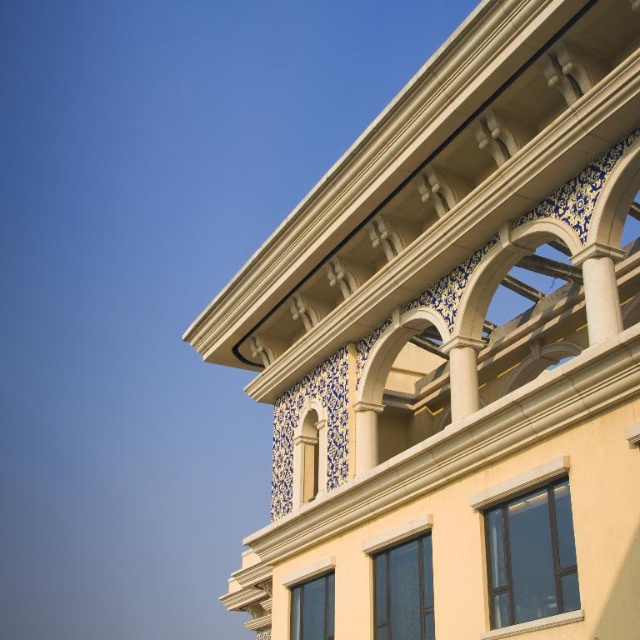
Question: Is yellow stucco building at upper right to the left of matte glass window at lower right from the viewer's perspective?

Choices:
 (A) no
 (B) yes

Answer: (A)

Question: Can you confirm if clear glass window at lower center is positioned to the right of matte cream tile at center?

Choices:
 (A) no
 (B) yes

Answer: (B)

Question: Based on their relative distances, which object is nearer to the clear glass window at lower center?

Choices:
 (A) matte glass window at center
 (B) matte glass window at lower right

Answer: (B)

Question: Which object is the farthest from the matte glass window at lower right?

Choices:
 (A) clear glass window at lower center
 (B) matte cream tile at center

Answer: (B)

Question: Does matte glass window at center appear on the left side of matte cream tile at center?

Choices:
 (A) no
 (B) yes

Answer: (A)

Question: Which object is the farthest from the matte cream tile at center?

Choices:
 (A) yellow stucco building at upper right
 (B) matte glass window at lower right
 (C) clear glass window at lower center
 (D) matte glass window at center

Answer: (B)